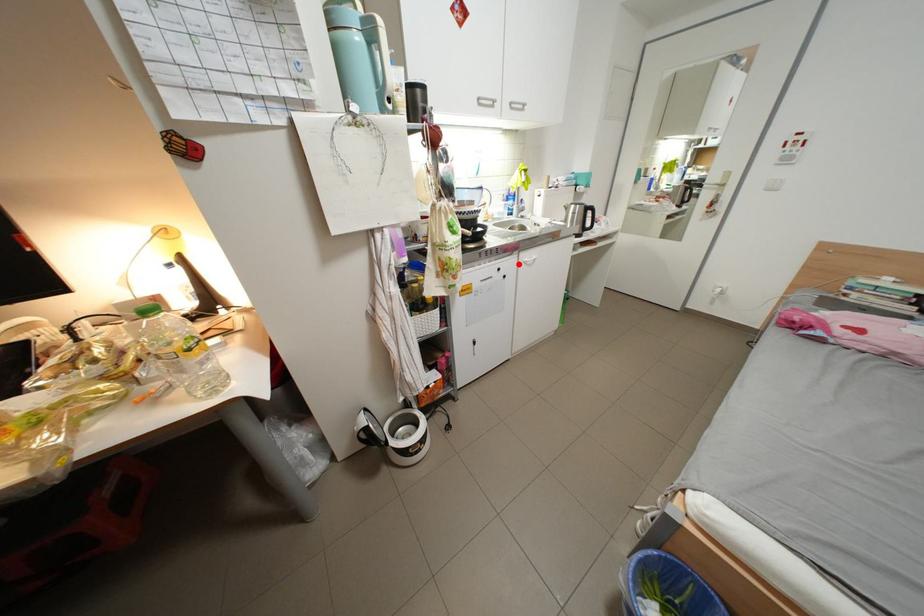
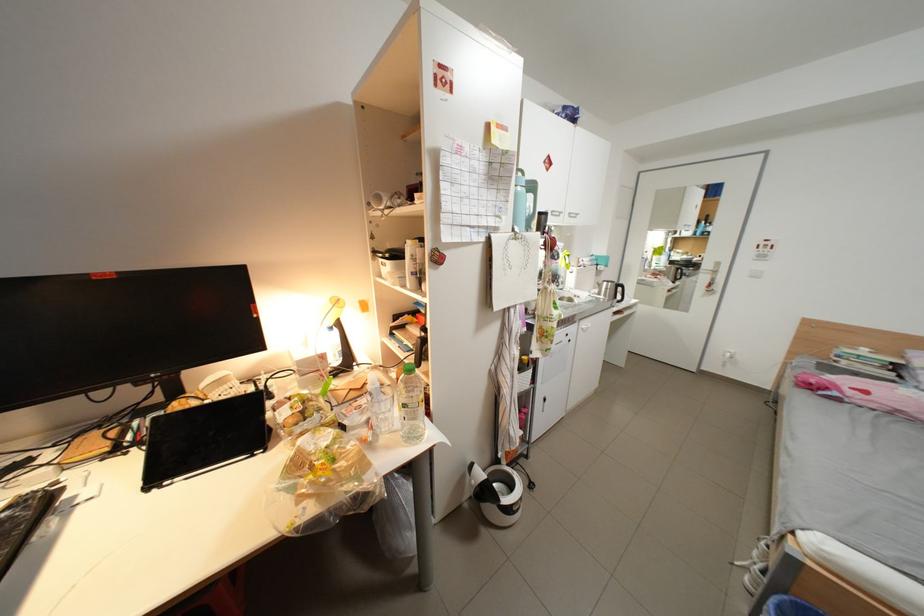
The point at the highlighted location is marked in the first image. Where is the corresponding point in the second image?

(582, 331)